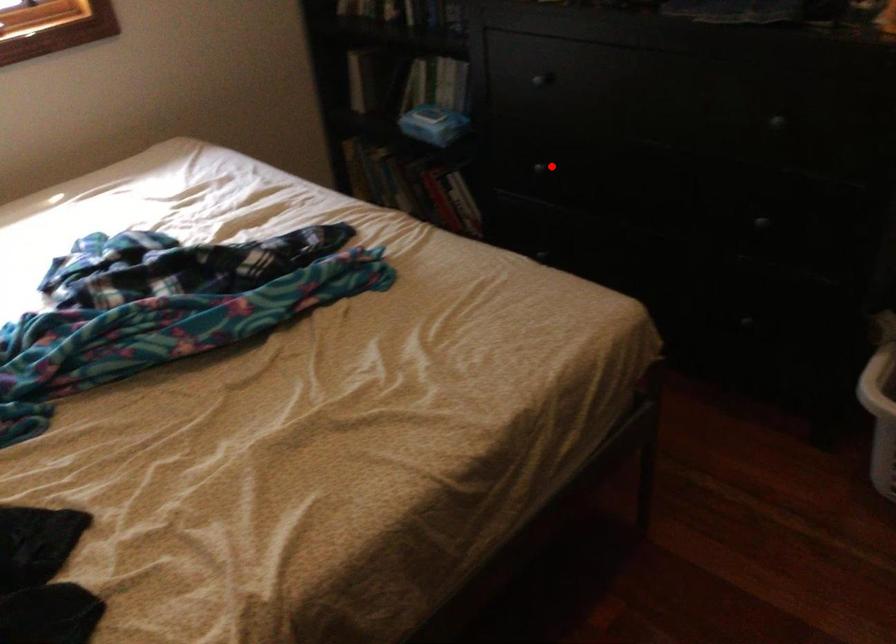
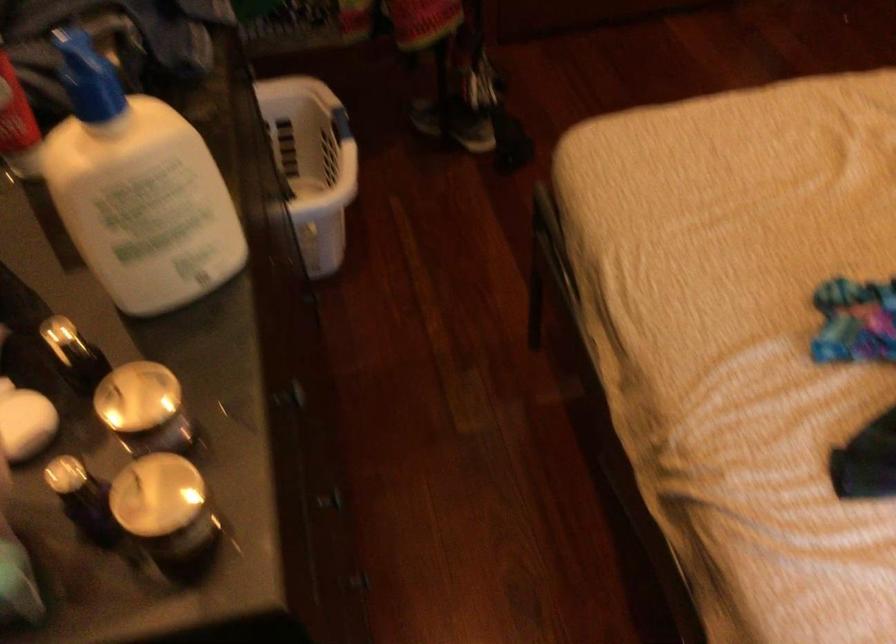
Where in the second image is the point corresponding to the highlighted location from the first image?

(330, 500)